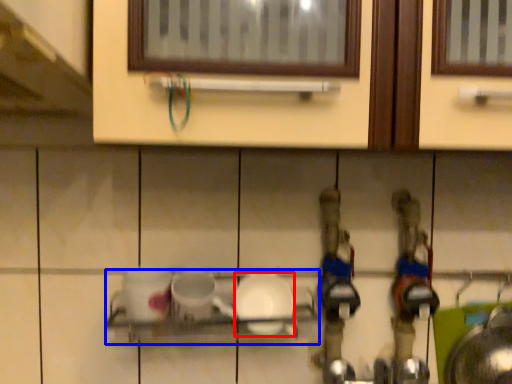
Question: Which of the following is the farthest to the observer, tableware (highlighted by a red box) or shelf (highlighted by a blue box)?

Choices:
 (A) tableware
 (B) shelf

Answer: (A)